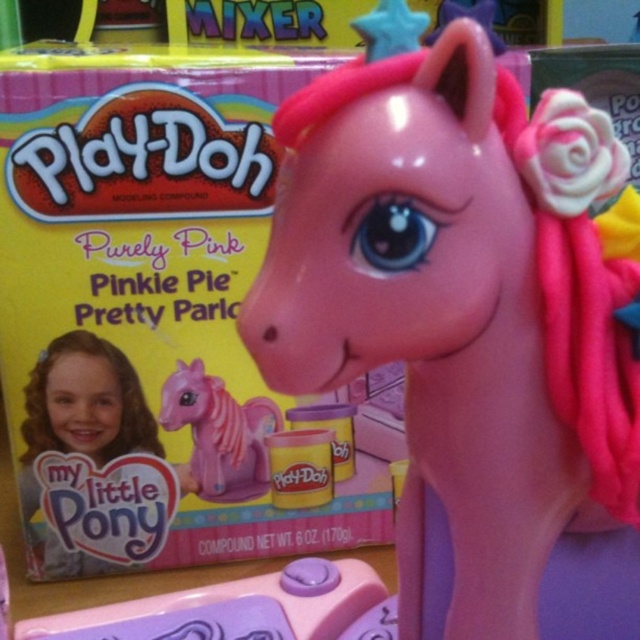
Can you confirm if matte purple plastic toy at center is thinner than pink matte plastic pony at center?

No, matte purple plastic toy at center is not thinner than pink matte plastic pony at center.

Is matte purple plastic toy at center to the right of pink matte plastic pony at center from the viewer's perspective?

No, matte purple plastic toy at center is not to the right of pink matte plastic pony at center.

Find the location of a particular element. matte purple plastic toy at center is located at coordinates (230, 608).

Does glossy plastic pony at center appear over smooth skin girl at center?

Correct, glossy plastic pony at center is located above smooth skin girl at center.

Who is more forward, (499,176) or (35,387)?

Point (499,176) is in front.

Find the location of a particular element. This screenshot has height=640, width=640. glossy plastic pony at center is located at coordinates (467, 323).

Is smooth skin girl at center below pink matte plastic pony at center?

Indeed, smooth skin girl at center is positioned under pink matte plastic pony at center.

Can you confirm if smooth skin girl at center is taller than pink matte plastic pony at center?

Yes.

Locate an element on the screen. Image resolution: width=640 pixels, height=640 pixels. smooth skin girl at center is located at coordinates (81, 435).